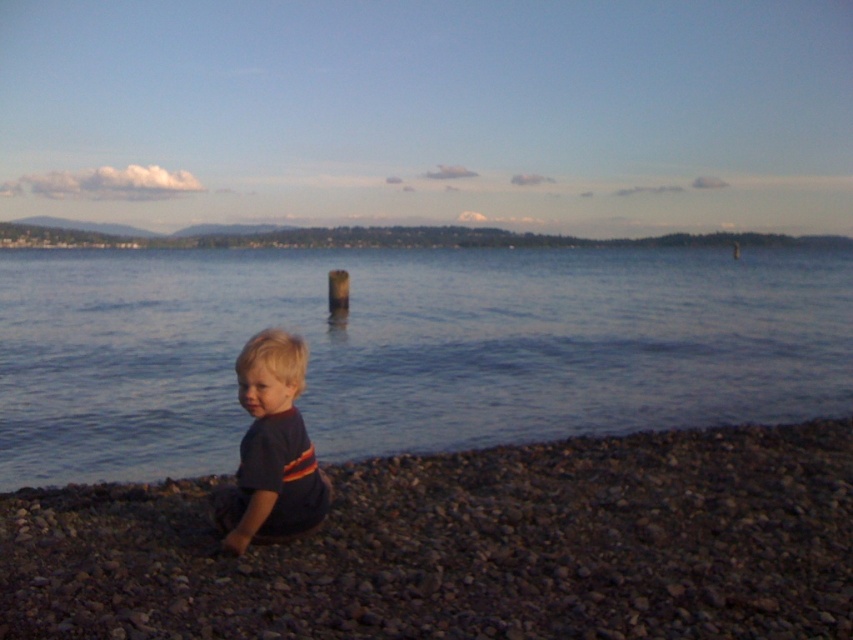
You are standing at the point marked by the coordinates point (405, 349). Looking around, you see blue water at lower left. What direction should you face to see the young child seated on the pebbled shoreline?

The young child is seated on the pebbled shoreline, which is in the opposite direction from the blue water at lower left. To see the child, you should face away from the blue water at lower left, likely towards the upper right or the direction where the shoreline is located.